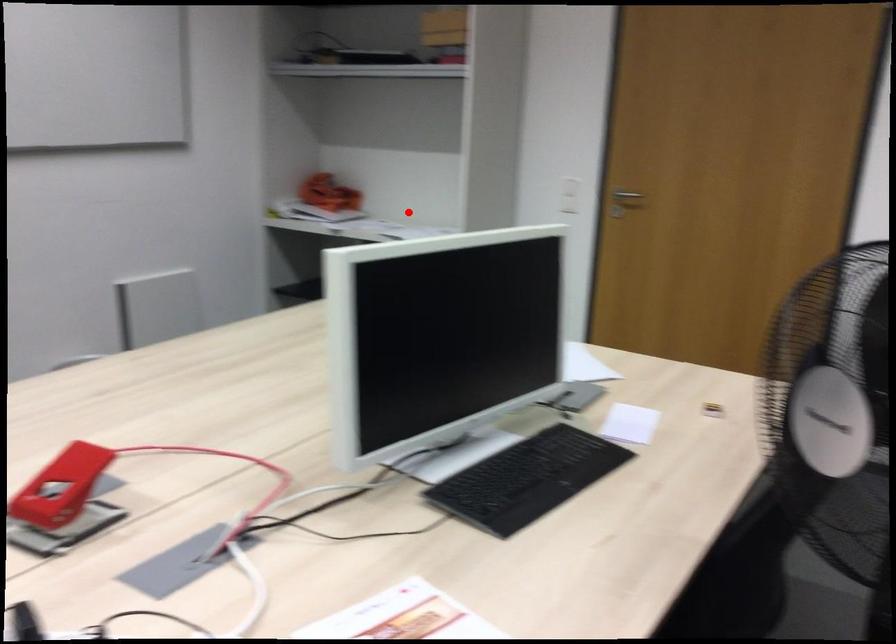
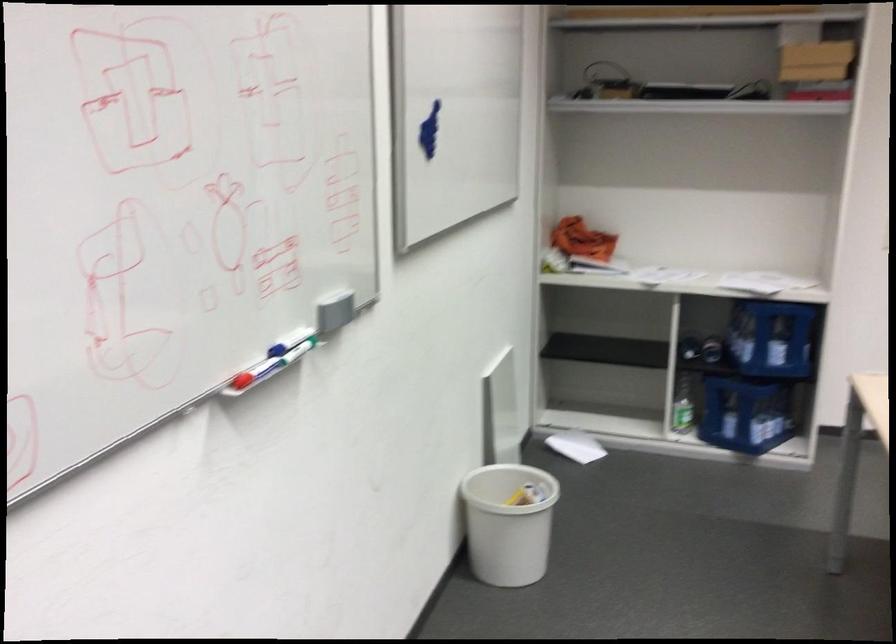
In the second image, find the point that corresponds to the highlighted location in the first image.

(660, 275)